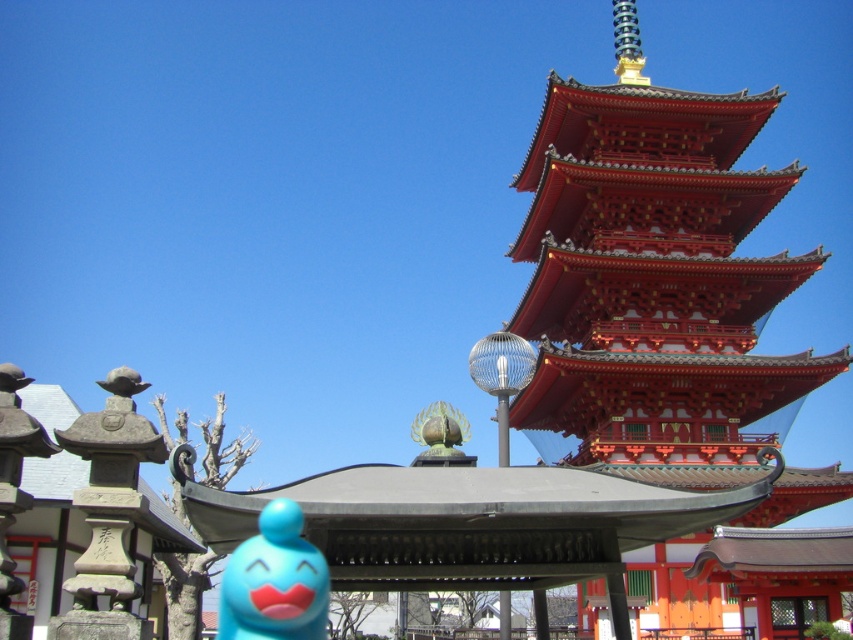
Does shiny lacquered pagoda at upper right appear on the left side of matte blue toy at lower left?

In fact, shiny lacquered pagoda at upper right is to the right of matte blue toy at lower left.

Between shiny lacquered pagoda at upper right and matte blue toy at lower left, which one has less height?

Standing shorter between the two is matte blue toy at lower left.

Is point (764, 406) farther from camera compared to point (300, 561)?

Yes, it is behind point (300, 561).

Locate an element on the screen. shiny lacquered pagoda at upper right is located at coordinates (654, 280).

Who is positioned more to the right, matte blue toy at lower left or green matte statue at center?

green matte statue at center

Does point (309, 609) come farther from viewer compared to point (412, 432)?

No.

Locate an element on the screen. The height and width of the screenshot is (640, 853). matte blue toy at lower left is located at coordinates (274, 580).

Where is `matte blue toy at lower left`? matte blue toy at lower left is located at coordinates (274, 580).

Consider the image. Is shiny lacquered pagoda at upper right thinner than green matte statue at center?

Incorrect, shiny lacquered pagoda at upper right's width is not less than green matte statue at center's.

Does point (653, 253) lie behind point (457, 458)?

Yes, point (653, 253) is behind point (457, 458).

Is point (665, 616) in front of point (427, 424)?

No, it is behind (427, 424).

Find the location of a particular element. shiny lacquered pagoda at upper right is located at coordinates (654, 280).